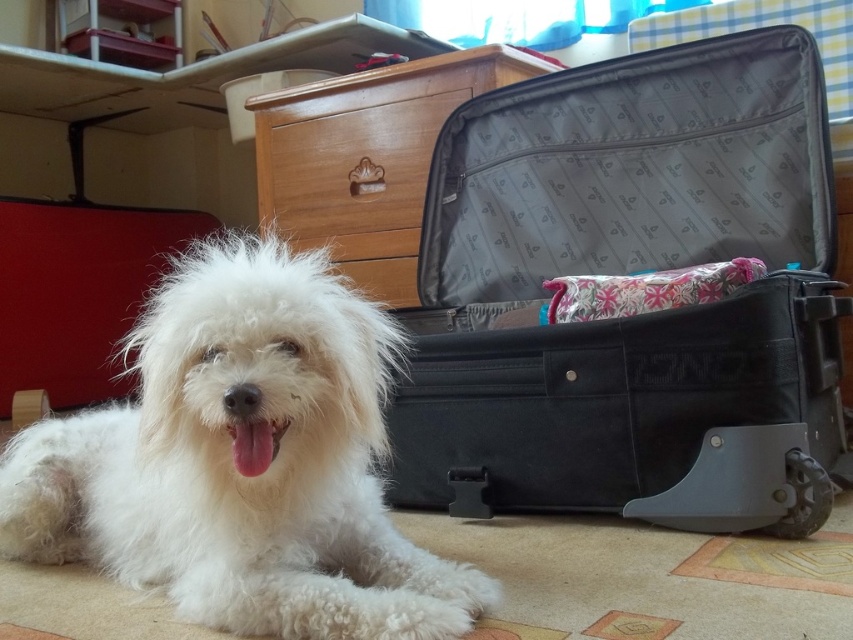
Which of these two, white fluffy dog at lower left or wooden drawer at center, stands taller?

With more height is wooden drawer at center.

Is point (380, 573) less distant than point (457, 64)?

Yes, point (380, 573) is closer to viewer.

Find the location of a particular element. white fluffy dog at lower left is located at coordinates (242, 460).

Is point (548, 433) farther from camera compared to point (477, 77)?

No, it is not.

Is black fabric suitcase at center to the right of wooden drawer at center from the viewer's perspective?

Correct, you'll find black fabric suitcase at center to the right of wooden drawer at center.

Describe the element at coordinates (631, 316) in the screenshot. The image size is (853, 640). I see `black fabric suitcase at center` at that location.

The width and height of the screenshot is (853, 640). I want to click on black fabric suitcase at center, so click(x=631, y=316).

Is point (451, 513) positioned behind point (258, 401)?

Yes, point (451, 513) is behind point (258, 401).

Which is in front, point (462, 371) or point (325, 324)?

Point (325, 324) is more forward.

You are a GUI agent. You are given a task and a screenshot of the screen. Output one action in this format:
    pyautogui.click(x=<x>, y=<y>)
    Task: Click on the black fabric suitcase at center
    
    Given the screenshot: What is the action you would take?
    pyautogui.click(x=631, y=316)